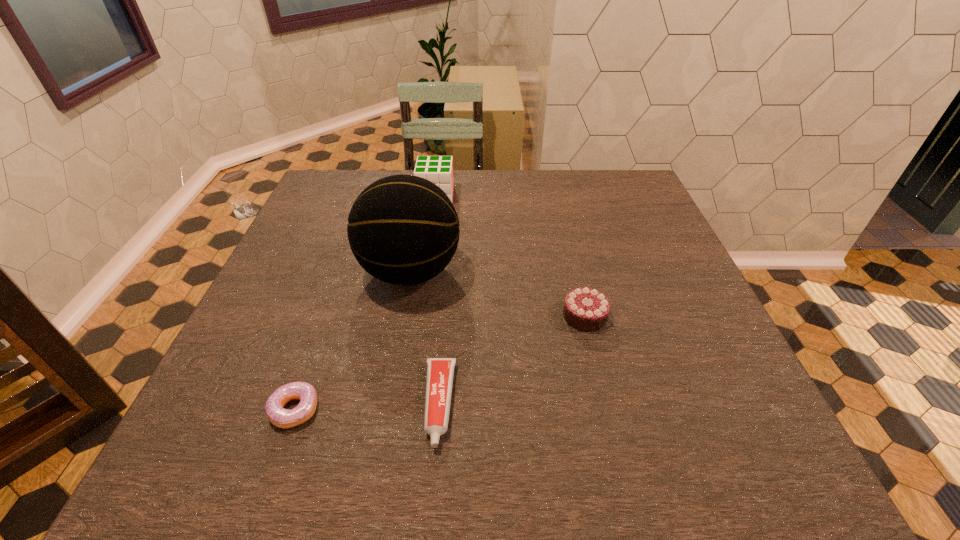
Find the location of `basketball`. basketball is located at coordinates (402, 229).

Where is `the farthest object`? Image resolution: width=960 pixels, height=540 pixels. the farthest object is located at coordinates (438, 169).

Find the location of `the fourth shortest object`. the fourth shortest object is located at coordinates (438, 169).

I want to click on the rightmost object, so click(x=586, y=309).

What are the coordinates of `the third tallest object` in the screenshot? It's located at (586, 309).

Image resolution: width=960 pixels, height=540 pixels. I want to click on doughnut, so click(283, 418).

In order to click on toothpaste in this screenshot , I will do `click(440, 371)`.

The image size is (960, 540). Identify the location of vacant space situated 0.210m on the right of the tallest object. (546, 272).

The width and height of the screenshot is (960, 540). Find the location of `vacant area situated 0.310m on the red face of the farthest object`. vacant area situated 0.310m on the red face of the farthest object is located at coordinates (555, 195).

Where is `vacant position located on the right of the chocolate cake`? The height and width of the screenshot is (540, 960). vacant position located on the right of the chocolate cake is located at coordinates (674, 316).